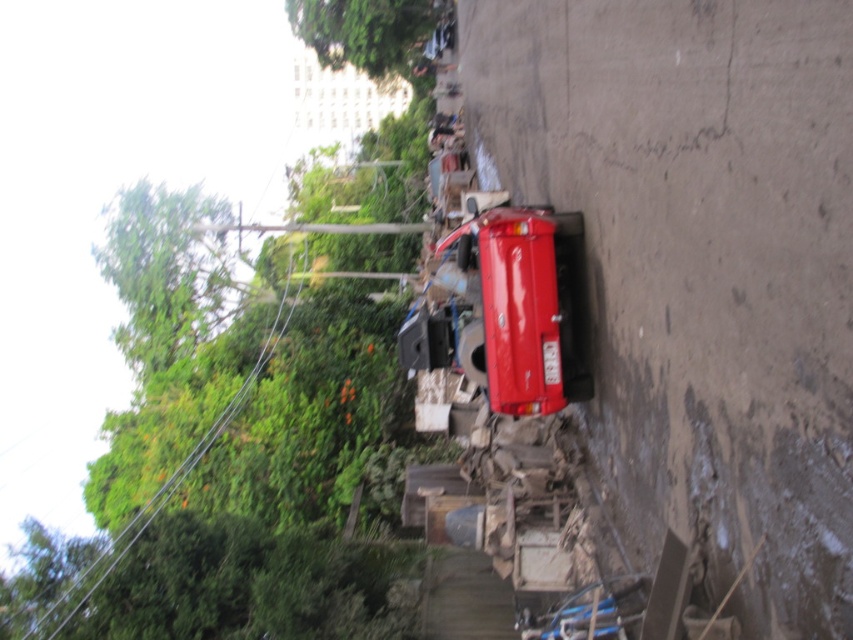
You are standing at the point with coordinates (521, 305) in the scene. What object are you currently standing on?

The point with coordinates (521, 305) is on the glossy red fire truck at center, so you are standing on the glossy red fire truck at center.

You are standing in the middle of the street and want to take a photo of both point (573, 392) and point (189, 465). Which point will appear larger in your camera view?

Point (573, 392) is closer to the camera than point (189, 465), so it will appear larger in the camera view.